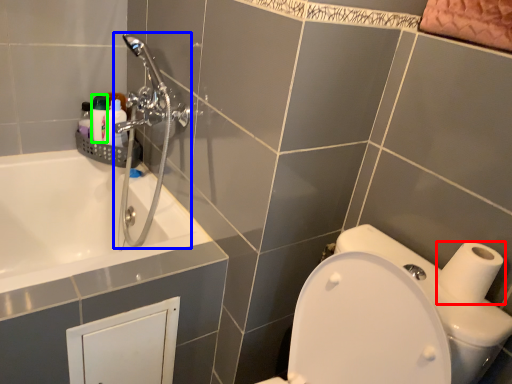
Question: Which object is positioned closest to toilet paper (highlighted by a red box)? Select from shower (highlighted by a blue box) and toiletry (highlighted by a green box).

Choices:
 (A) shower
 (B) toiletry

Answer: (A)